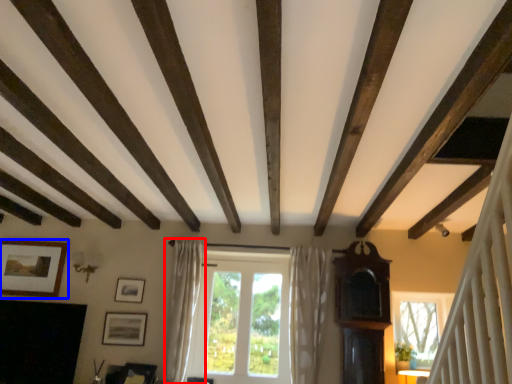
Question: Which point is closer to the camera, curtain (highlighted by a red box) or picture frame (highlighted by a blue box)?

Choices:
 (A) curtain
 (B) picture frame

Answer: (A)